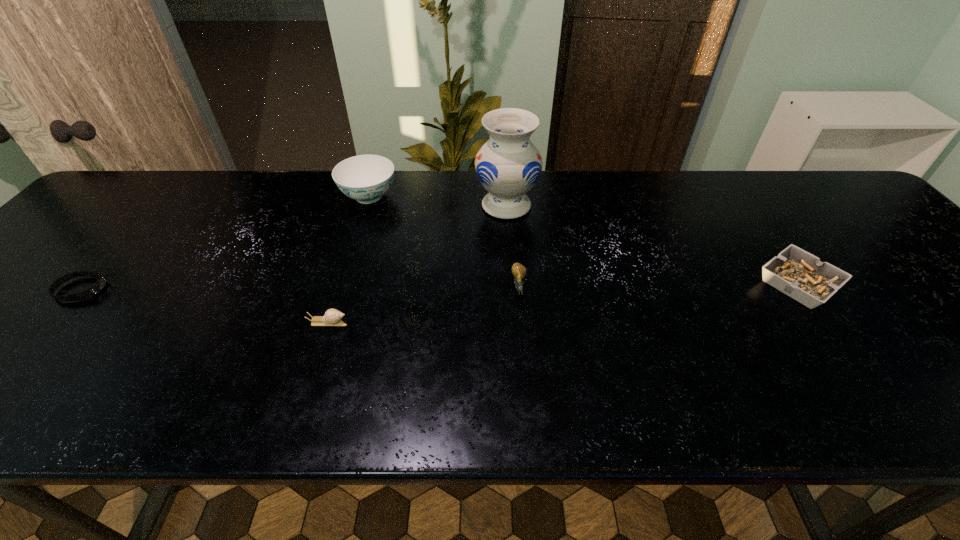
This screenshot has width=960, height=540. Identify the location of the tallest object. (508, 165).

At what (x,y) coordinates should I click in order to perform the action: click on the fifth shortest object. Please return your answer as a coordinate pair (x, y). This screenshot has width=960, height=540. Looking at the image, I should click on (365, 178).

The image size is (960, 540). I want to click on the right escargot, so click(x=519, y=271).

In order to click on the farther escargot in this screenshot , I will do `click(519, 271)`.

You are a GUI agent. You are given a task and a screenshot of the screen. Output one action in this format:
    pyautogui.click(x=<x>, y=<y>)
    Task: Click on the rightmost object
    This screenshot has height=540, width=960.
    Given the screenshot: What is the action you would take?
    pyautogui.click(x=795, y=272)

This screenshot has height=540, width=960. Identify the location of the shorter escargot. (332, 317).

Image resolution: width=960 pixels, height=540 pixels. I want to click on the nearer escargot, so click(332, 317).

Image resolution: width=960 pixels, height=540 pixels. Find the location of `the shortest object`. the shortest object is located at coordinates (97, 287).

Identify the location of the leftmost object. The width and height of the screenshot is (960, 540). (97, 287).

Identify the location of vacant region located on the left of the vase. coord(361,206).